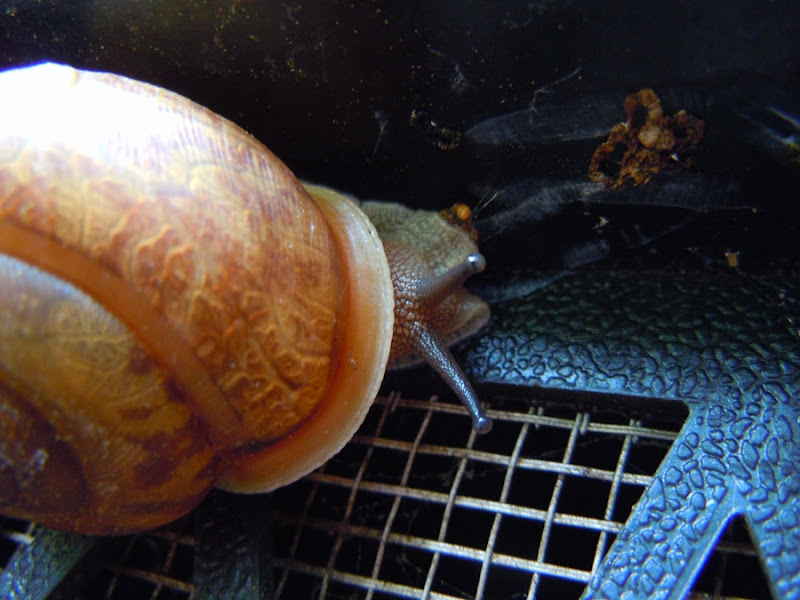
Locate an element on the screen. grate is located at coordinates (548, 524).